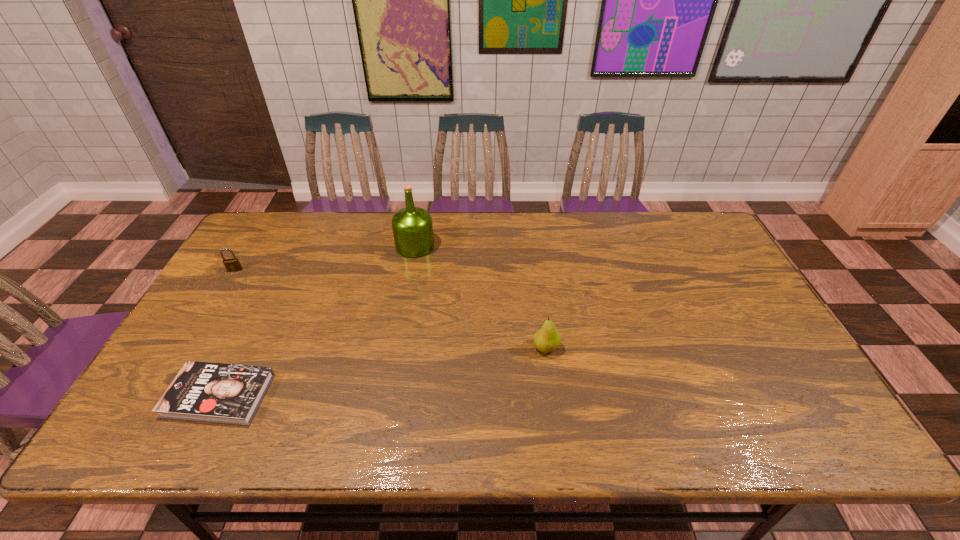
The height and width of the screenshot is (540, 960). I want to click on vacant space at the right edge, so click(789, 372).

You are a GUI agent. You are given a task and a screenshot of the screen. Output one action in this format:
    pyautogui.click(x=<x>, y=<y>)
    Task: Click on the free space at the far left corner of the desktop
    This screenshot has width=960, height=540.
    Given the screenshot: What is the action you would take?
    pyautogui.click(x=305, y=211)

Locate an element on the screen. This screenshot has height=540, width=960. vacant space at the near left corner of the desktop is located at coordinates (130, 429).

The width and height of the screenshot is (960, 540). What are the coordinates of `vacant area at the far right corner` in the screenshot? It's located at (701, 228).

Locate an element on the screen. Image resolution: width=960 pixels, height=540 pixels. empty space between the third tallest object and the third object from right to left is located at coordinates (228, 333).

You are a GUI agent. You are given a task and a screenshot of the screen. Output one action in this format:
    pyautogui.click(x=<x>, y=<y>)
    Task: Click on the free space between the second nearest object and the tallest object
    Image resolution: width=960 pixels, height=540 pixels.
    Given the screenshot: What is the action you would take?
    pyautogui.click(x=480, y=297)

The width and height of the screenshot is (960, 540). Identify the location of blank region between the leftmost object and the olive oil. (325, 258).

Where is `free space that is in between the shortest object and the third shortest object`? free space that is in between the shortest object and the third shortest object is located at coordinates (382, 372).

Locate an element on the screen. Image resolution: width=960 pixels, height=540 pixels. free space between the second farthest object and the rightmost object is located at coordinates (391, 309).

Where is `free space between the rightmost object and the leftmost object`? The width and height of the screenshot is (960, 540). free space between the rightmost object and the leftmost object is located at coordinates (391, 309).